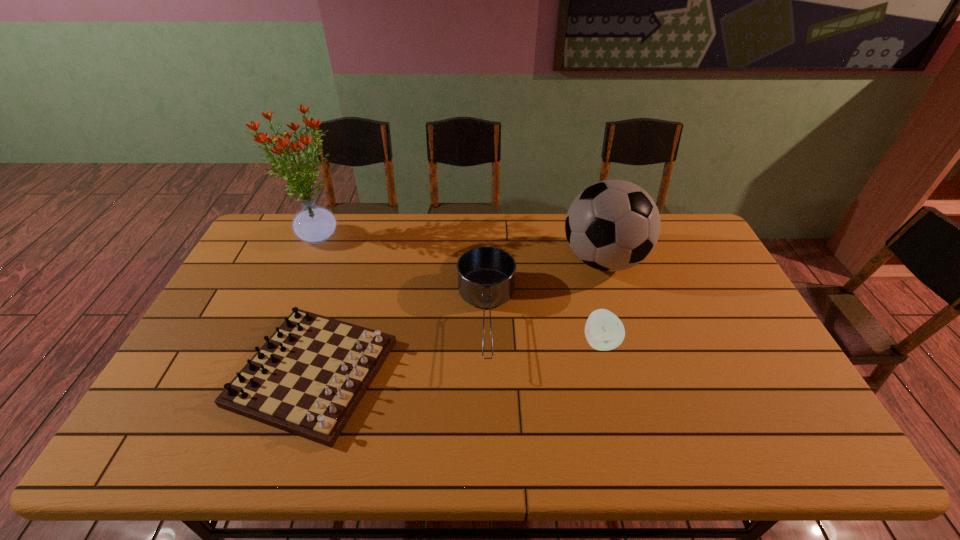
In the image, there is a desktop. At what (x,y) coordinates should I click in order to perform the action: click on vacant space at the right edge. Please return your answer as a coordinate pair (x, y). This screenshot has height=540, width=960. Looking at the image, I should click on (733, 350).

At what (x,y) coordinates should I click in order to perform the action: click on free space at the near left corner of the desktop. Please return your answer as a coordinate pair (x, y). The image size is (960, 540). Looking at the image, I should click on (170, 458).

This screenshot has height=540, width=960. I want to click on vacant space at the far right corner of the desktop, so click(x=668, y=227).

Locate an element on the screen. The width and height of the screenshot is (960, 540). vacant area between the fourth shortest object and the saucepan is located at coordinates (545, 289).

What are the coordinates of `blank region between the apple and the chessboard` in the screenshot? It's located at (457, 357).

Image resolution: width=960 pixels, height=540 pixels. In order to click on free space between the flower arrangement and the chessboard in this screenshot , I will do `click(317, 303)`.

In order to click on free spot between the chessboard and the second tallest object in this screenshot , I will do `click(458, 316)`.

Find the location of `free point between the fourth shortest object and the apple`. free point between the fourth shortest object and the apple is located at coordinates (602, 301).

You are a GUI agent. You are given a task and a screenshot of the screen. Output one action in this format:
    pyautogui.click(x=<x>, y=<y>)
    Task: Click on the vacant region between the apple and the shortest object
    
    Given the screenshot: What is the action you would take?
    pyautogui.click(x=457, y=357)

You are a GUI agent. You are given a task and a screenshot of the screen. Output one action in this format:
    pyautogui.click(x=<x>, y=<y>)
    Task: Click on the free space between the tallest object and the third object from left to right
    This screenshot has height=540, width=960.
    Given the screenshot: What is the action you would take?
    pyautogui.click(x=403, y=276)